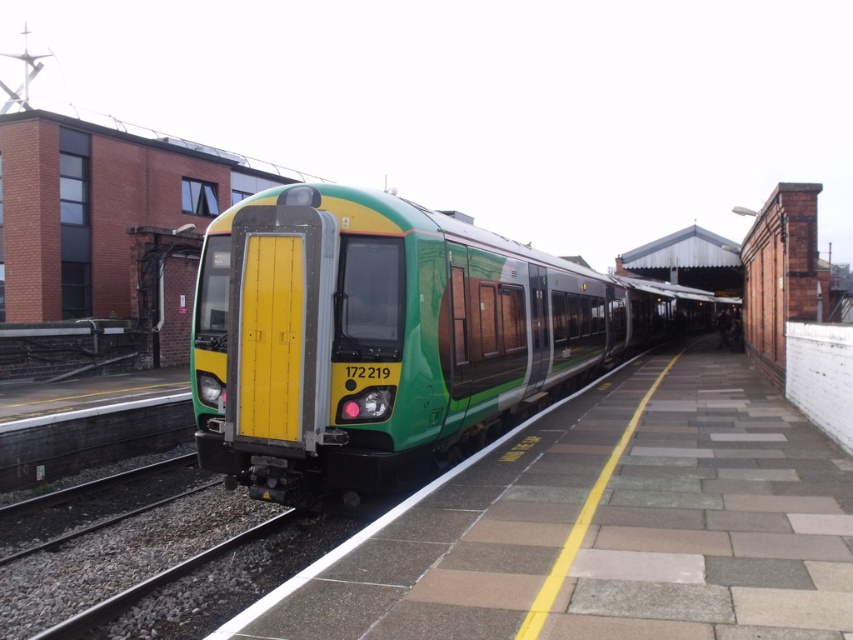
Question: Which object appears farthest from the camera in this image?

Choices:
 (A) green matte platform at center
 (B) green matte train at center

Answer: (B)

Question: Can you confirm if green matte platform at center is positioned to the right of green matte train at center?

Choices:
 (A) yes
 (B) no

Answer: (B)

Question: Which point is farther to the camera?

Choices:
 (A) green matte platform at center
 (B) green matte train at center

Answer: (B)

Question: Is green matte platform at center thinner than green matte train at center?

Choices:
 (A) yes
 (B) no

Answer: (A)

Question: Where is green matte platform at center located in relation to green matte train at center in the image?

Choices:
 (A) below
 (B) above

Answer: (A)